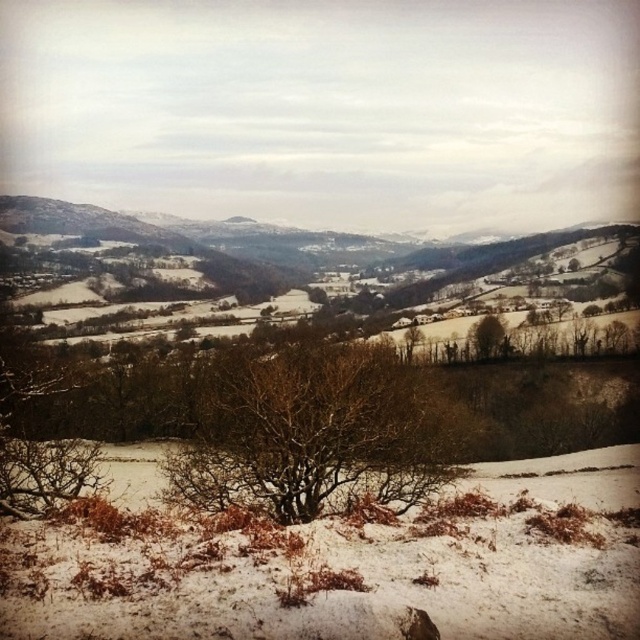
You are an observer standing in the valley and see the bare branches at center and the brown textured tree at center. Which object is shorter?

The bare branches at center is shorter than the brown textured tree at center.

You are standing at the edge of the valley looking towards the center. Which direction should you walk to reach the bare branches at center?

You should walk towards the center of the valley to reach the bare branches at center.

You are an observer standing in the valley looking at the winter landscape. You notice the bare branches at center and the brown textured tree at center. Which object is closer to the ground?

The bare branches at center is located below brown textured tree at center, so it is closer to the ground.